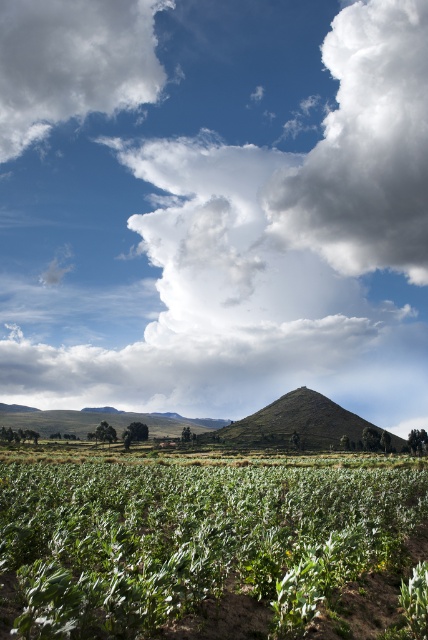
You are standing in the rural landscape and want to take a photo of the green grassy hill at center. However, there is a white fluffy cloud at upper center in the way. Can you adjust your position to avoid the cloud blocking the hill?

The white fluffy cloud at upper center is further to the viewer than the green grassy hill at center, so moving closer to the hill or adjusting your angle might help avoid the cloud blocking it.

In the scene shown: You are a farmer checking the crops and notice the green leafy plants at lower left and the white fluffy cloud at upper left. Which object is closer to the ground?

The green leafy plants at lower left are closer to the ground since they are smaller than the white fluffy cloud at upper left, which is higher in the sky.